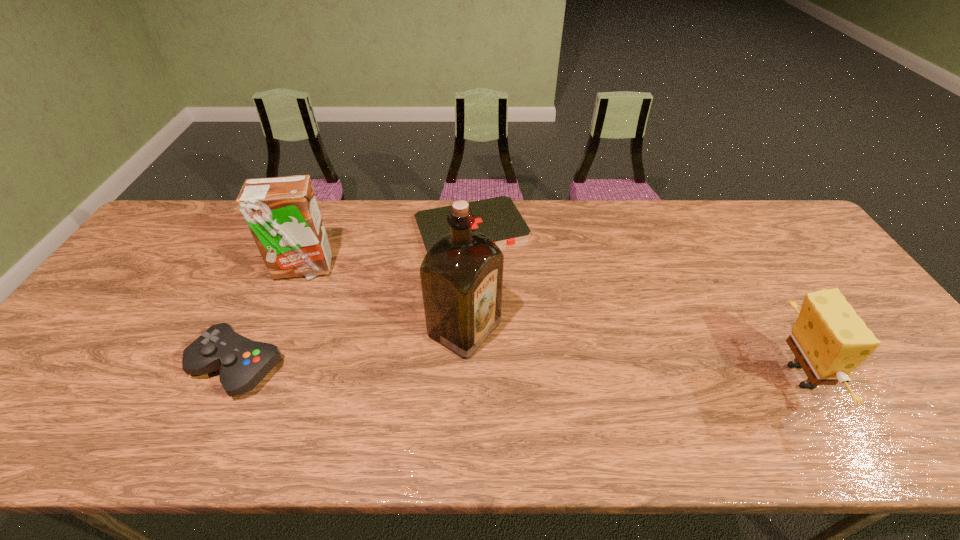
Find the location of `free space on the desktop that is between the control and the third shortest object and is positioned on the straw side of the fourth shortest object`. free space on the desktop that is between the control and the third shortest object and is positioned on the straw side of the fourth shortest object is located at coordinates pos(434,370).

This screenshot has width=960, height=540. Identify the location of free spot on the desktop that is between the fourth tallest object and the rightmost object and is positioned on the label of the tallest object. point(540,372).

I want to click on free spot on the desktop that is between the second shortest object and the rightmost object and is positioned on handle side the shortest object, so click(540, 372).